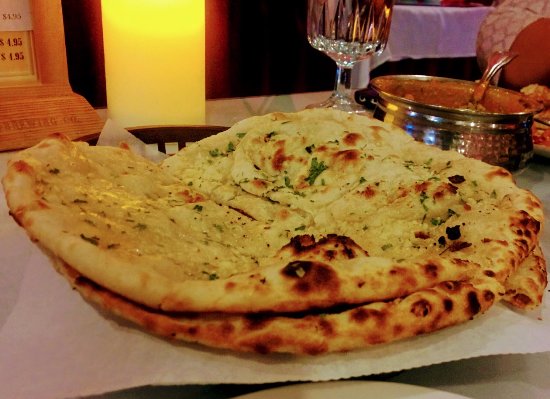
The height and width of the screenshot is (399, 550). I want to click on glass, so click(354, 33).